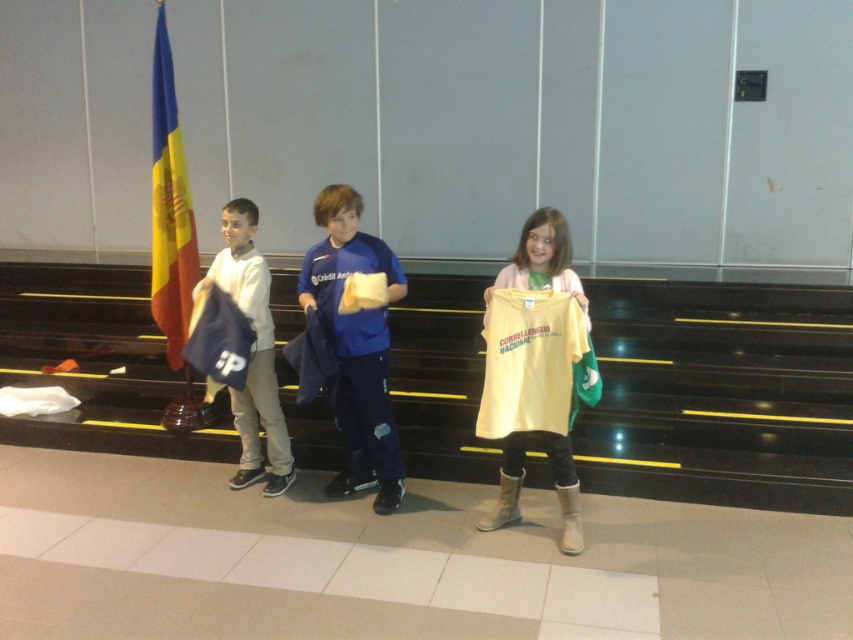
Question: Can you confirm if matte blue bag at left is smaller than yellow matte shirt at center?

Choices:
 (A) no
 (B) yes

Answer: (A)

Question: Can you confirm if black glossy stairs at center is positioned to the left of blue and yellow fabric flag at left?

Choices:
 (A) no
 (B) yes

Answer: (A)

Question: Based on their relative distances, which object is farther from the black glossy stairs at center?

Choices:
 (A) yellow matte shirt at center
 (B) blue fabric jacket at center

Answer: (B)

Question: Which object is positioned farthest from the yellow matte shirt at center?

Choices:
 (A) black glossy stairs at center
 (B) blue and yellow fabric flag at left
 (C) matte blue bag at left
 (D) blue fabric jacket at center

Answer: (B)

Question: Is black glossy stairs at center to the left of yellow matte shirt at center from the viewer's perspective?

Choices:
 (A) no
 (B) yes

Answer: (A)

Question: Based on their relative distances, which object is nearer to the matte blue bag at left?

Choices:
 (A) blue and yellow fabric flag at left
 (B) blue fabric jacket at center

Answer: (B)